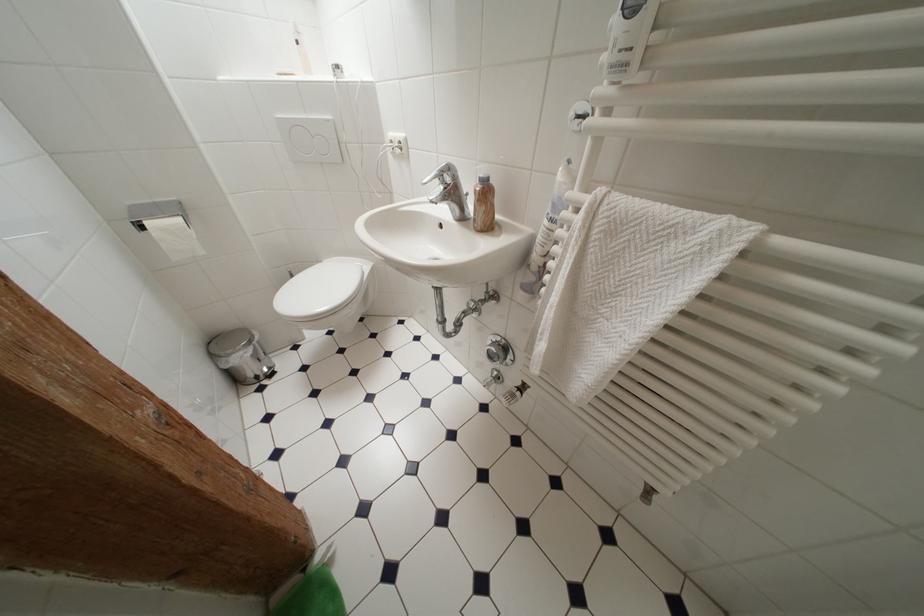
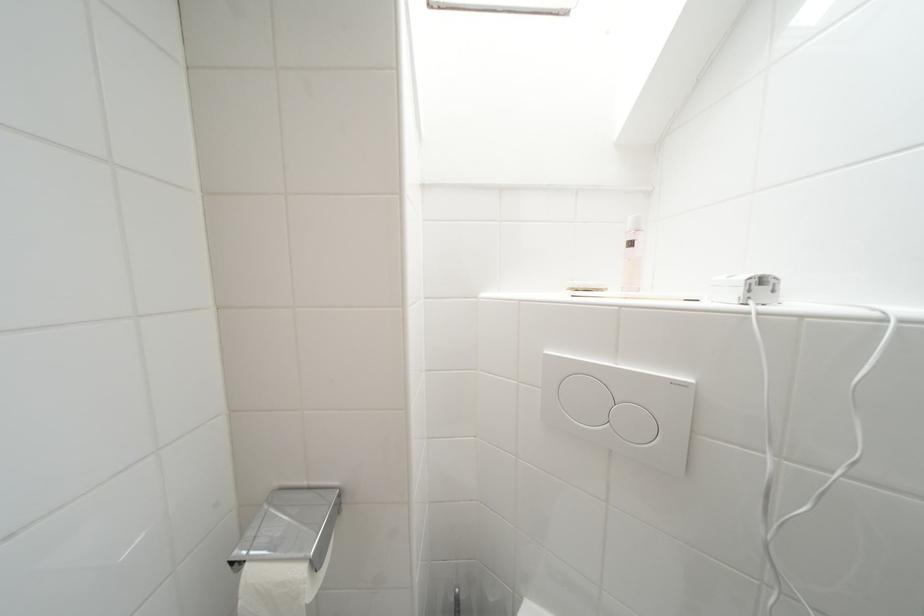
In the second image, find the point that corresponds to (304,46) in the first image.

(638, 246)